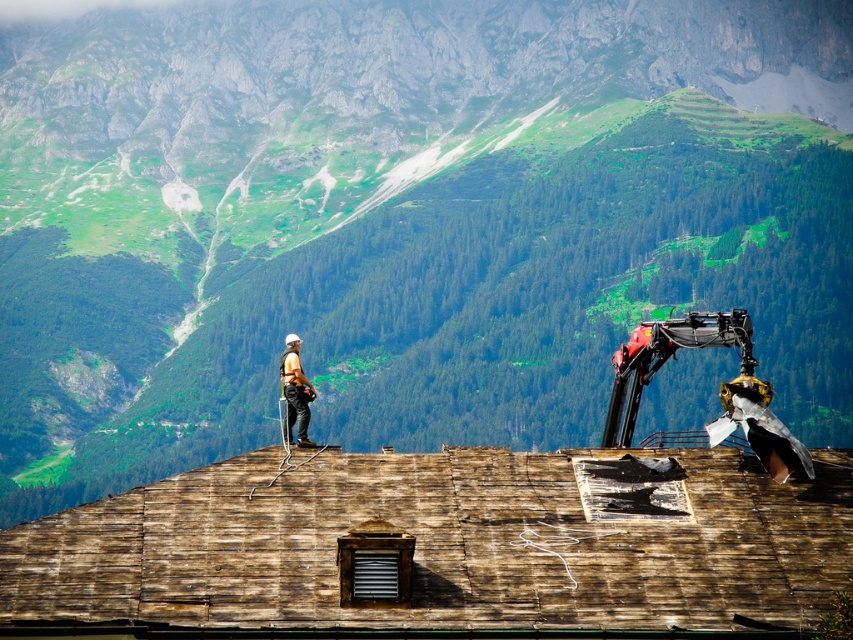
You are a safety inspector at the construction site. You need to ensure that the metallic red robotic arm at upper right can safely move over the weathered wood roof at center without damaging it. Based on their positions, can the robotic arm move over the roof?

The weathered wood roof at center is located below the metallic red robotic arm at upper right, so the robotic arm can move over the roof safely without causing damage.

Based on the scene description, where is the weathered wood roof at center located in the image?

The weathered wood roof at center is located at point [444,545].

Based on the photo, what are the coordinates of the weathered wood roof at center?

The weathered wood roof at center is located at coordinates point (444, 545).